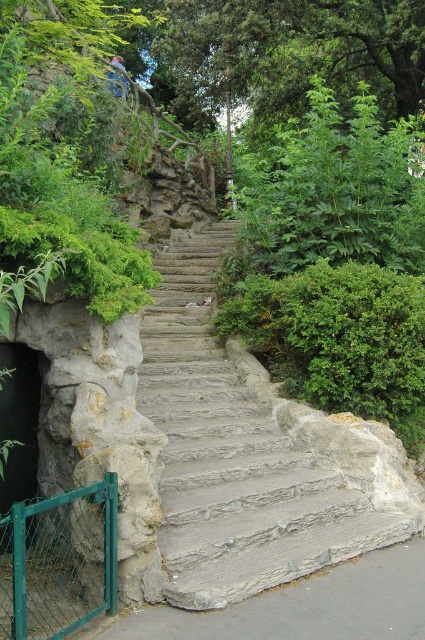
Is point (203, 365) closer to viewer compared to point (118, 88)?

Yes, point (203, 365) is closer to viewer.

Which is behind, point (252, 426) or point (119, 86)?

The point (119, 86) is more distant.

At what (x,y) coordinates should I click in order to perform the action: click on gray stone stairs at center. Please return your answer as a coordinate pair (x, y). Looking at the image, I should click on (252, 452).

Describe the element at coordinates (67, 163) in the screenshot. I see `green leafy bush at upper left` at that location.

In the scene shown: Is green leafy bush at upper left bigger than dark gray stone entrance at left?

Indeed, green leafy bush at upper left has a larger size compared to dark gray stone entrance at left.

Is point (136, 240) behind point (2, 380)?

Yes, point (136, 240) is behind point (2, 380).

Find the location of a particular element. The image size is (425, 640). green leafy bush at upper left is located at coordinates coord(67,163).

Is green leafy bush at upper left below metallic silver skateboard at upper center?

Correct, green leafy bush at upper left is located below metallic silver skateboard at upper center.

Does green leafy bush at upper left appear over metallic silver skateboard at upper center?

No.

Locate an element on the screen. This screenshot has height=640, width=425. green leafy bush at upper left is located at coordinates (67, 163).